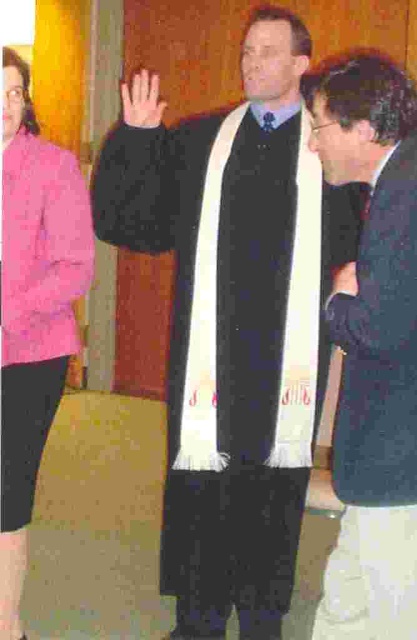
You are a photographer at this event. You need to capture a closeup of both the smooth skin hand at center and the matte black hand at center. Given that your camera can only focus on one hand at a time, which hand should you focus on first to ensure the larger one is in focus?

The smooth skin hand at center is bigger than the matte black hand at center, so you should focus on the smooth skin hand at center first to ensure the larger one is in focus.